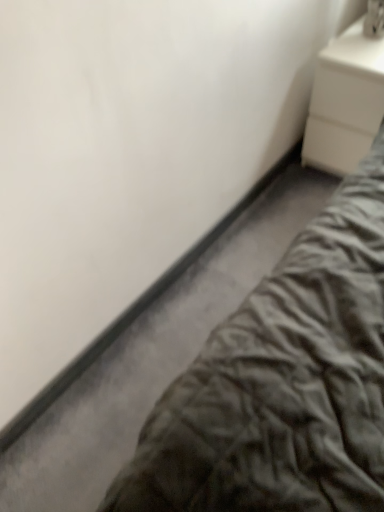
Question: Is velvet gray bed at lower right to the left or to the right of white matte nightstand at upper right in the image?

Choices:
 (A) left
 (B) right

Answer: (A)

Question: Considering the positions of velvet gray bed at lower right and white matte nightstand at upper right in the image, is velvet gray bed at lower right wider or thinner than white matte nightstand at upper right?

Choices:
 (A) thin
 (B) wide

Answer: (B)

Question: From the image's perspective, is velvet gray bed at lower right above or below white matte nightstand at upper right?

Choices:
 (A) below
 (B) above

Answer: (A)

Question: Considering the positions of point (334, 97) and point (148, 453), is point (334, 97) closer or farther from the camera than point (148, 453)?

Choices:
 (A) closer
 (B) farther

Answer: (B)

Question: From the image's perspective, is white matte nightstand at upper right located above or below velvet gray bed at lower right?

Choices:
 (A) below
 (B) above

Answer: (B)

Question: Considering the positions of white matte nightstand at upper right and velvet gray bed at lower right in the image, is white matte nightstand at upper right bigger or smaller than velvet gray bed at lower right?

Choices:
 (A) big
 (B) small

Answer: (A)

Question: Based on their positions, is white matte nightstand at upper right located to the left or right of velvet gray bed at lower right?

Choices:
 (A) right
 (B) left

Answer: (A)